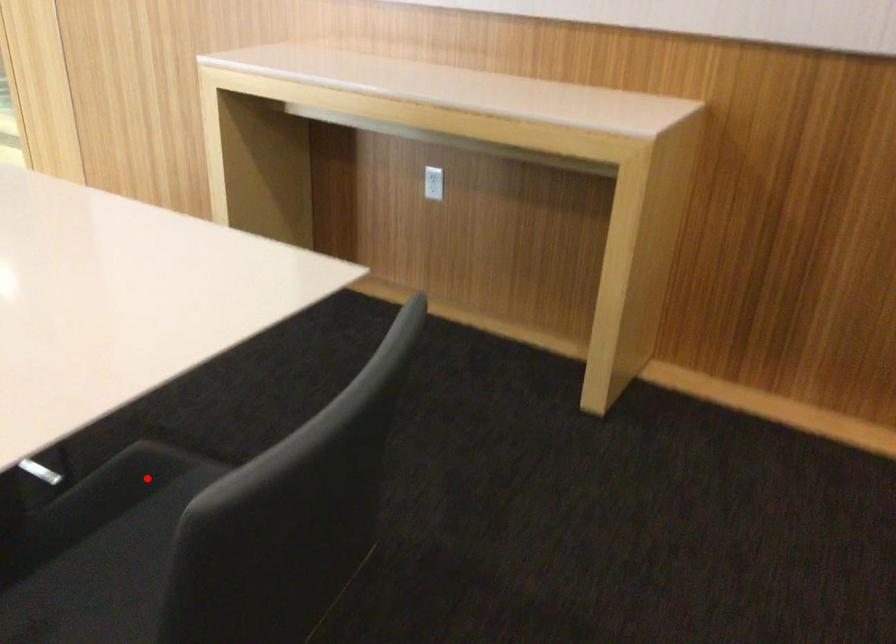
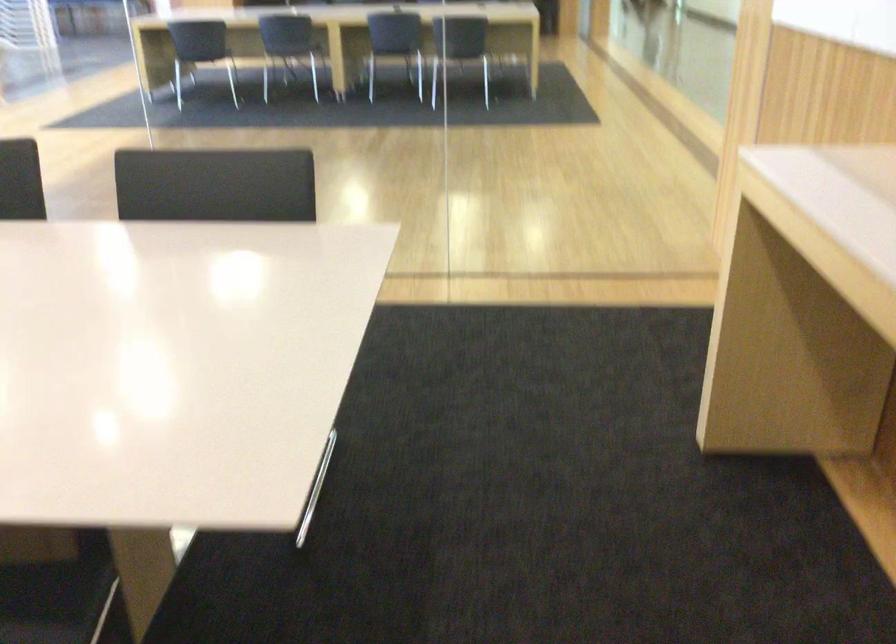
Question: I am providing you with two images of the same scene from different viewpoints. In image1, a red point is highlighted. Considering the same 3D point in image2, which of the following is correct?

Choices:
 (A) It is closer
 (B) It is farther

Answer: (A)